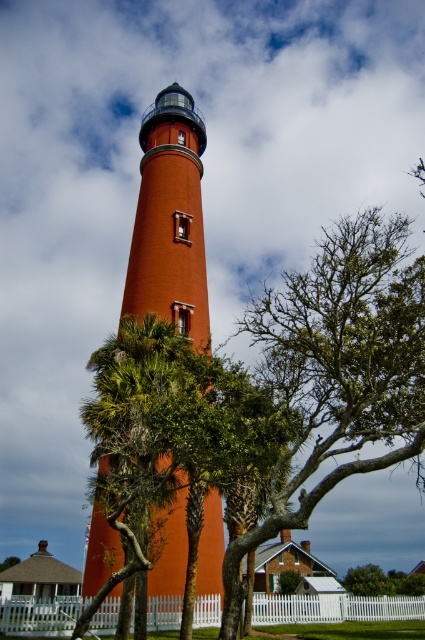
Looking at this image, can you confirm if green leafy tree at center is positioned above green leafy palm tree at center?

Yes, green leafy tree at center is above green leafy palm tree at center.

Looking at this image, who is more distant from viewer, [283,412] or [95,483]?

The point [283,412] is behind.

Which is in front, point (292, 515) or point (96, 392)?

Positioned in front is point (292, 515).

Locate an element on the screen. The height and width of the screenshot is (640, 425). green leafy tree at center is located at coordinates tap(337, 371).

Can you confirm if green leafy tree at center is smaller than smooth orange lighthouse at center?

No, green leafy tree at center is not smaller than smooth orange lighthouse at center.

Does green leafy tree at center have a lesser height compared to smooth orange lighthouse at center?

No, green leafy tree at center is not shorter than smooth orange lighthouse at center.

Is point (416, 401) positioned behind point (175, 292)?

That is False.

The height and width of the screenshot is (640, 425). Find the location of `green leafy tree at center`. green leafy tree at center is located at coordinates (337, 371).

Between green leafy palm tree at center and smooth orange lighthouse at center, which one appears on the left side from the viewer's perspective?

From the viewer's perspective, green leafy palm tree at center appears more on the left side.

Is green leafy palm tree at center bigger than smooth orange lighthouse at center?

Yes, green leafy palm tree at center is bigger than smooth orange lighthouse at center.

Is point (156, 448) less distant than point (195, 292)?

Yes.

In order to click on green leafy palm tree at center in this screenshot , I will do `click(144, 436)`.